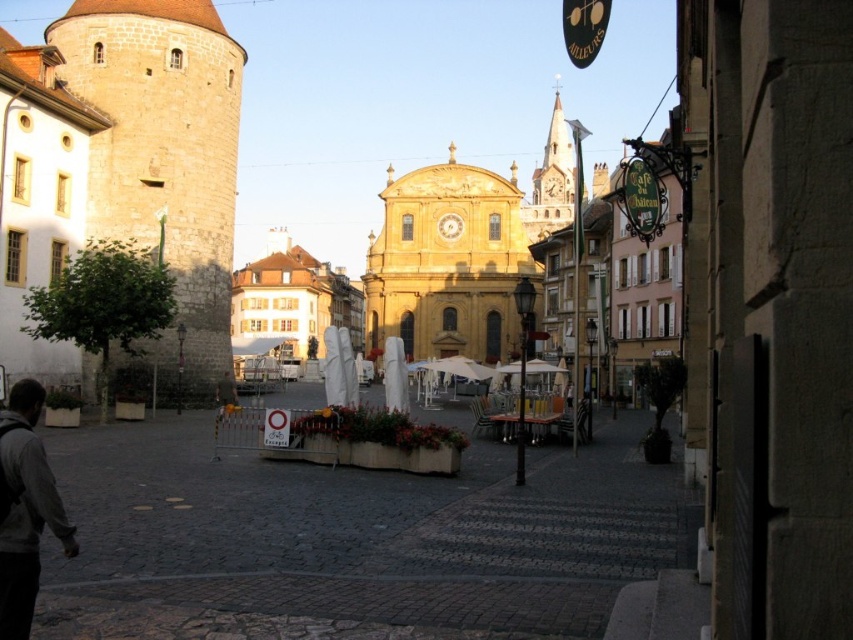
You are standing in the European town square and want to walk towards the smooth stone alley at center. From your current position near the gray hoodie at lower left, which direction should you move?

To reach the smooth stone alley at center from the gray hoodie at lower left, you should move to the right since the smooth stone alley at center is located to the right of the gray hoodie at lower left.